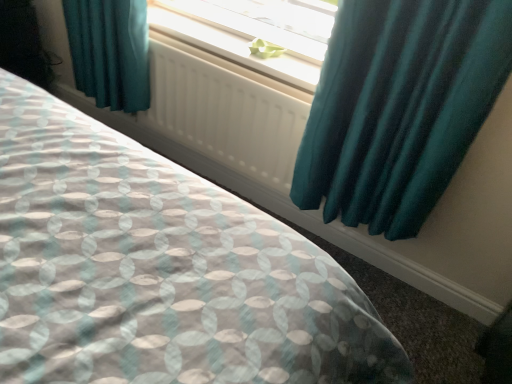
Question: Considering the positions of point (206, 48) and point (158, 97), is point (206, 48) closer or farther from the camera than point (158, 97)?

Choices:
 (A) closer
 (B) farther

Answer: (A)

Question: Is white plastic radiator at upper center wider or thinner than white matte radiator at center?

Choices:
 (A) thin
 (B) wide

Answer: (B)

Question: Estimate the real-world distances between objects in this image. Which object is closer to the white plastic radiator at upper center?

Choices:
 (A) green paper at center
 (B) teal satin curtain at upper right
 (C) white matte radiator at center

Answer: (A)

Question: Considering the real-world distances, which object is farthest from the green paper at center?

Choices:
 (A) teal satin curtain at upper right
 (B) white plastic radiator at upper center
 (C) white matte radiator at center

Answer: (A)